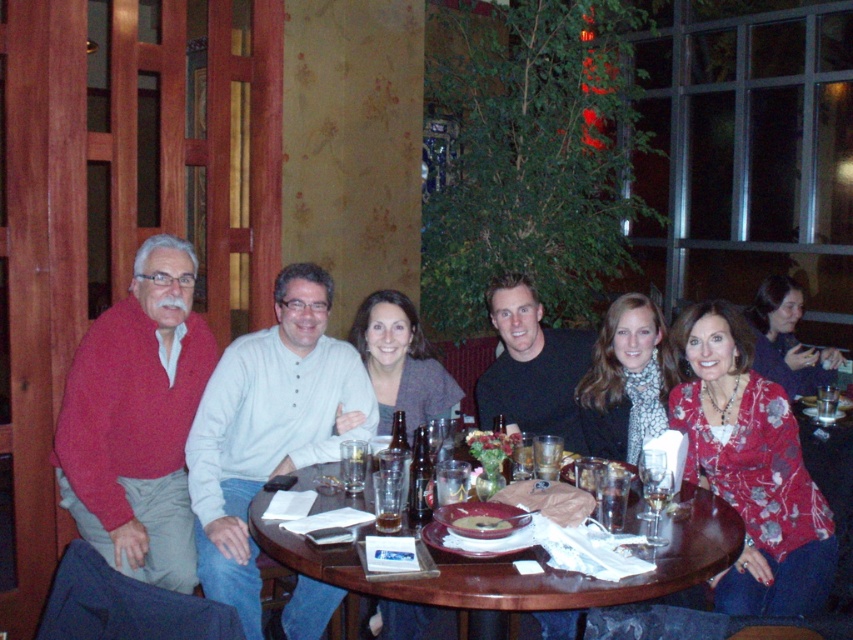
Question: Is knitted red sweater at left smaller than white button-down shirt at center?

Choices:
 (A) no
 (B) yes

Answer: (B)

Question: Where is knitted red sweater at left located in relation to dark blue sweater at right in the image?

Choices:
 (A) above
 (B) below

Answer: (B)

Question: Does matte red sweater at left have a lesser width compared to translucent glass at table center?

Choices:
 (A) no
 (B) yes

Answer: (A)

Question: Which object is farther from the camera taking this photo?

Choices:
 (A) floral-patterned blouse at lower right
 (B) matte red sweater at left

Answer: (B)

Question: Among these objects, which one is nearest to the camera?

Choices:
 (A) smooth brown bread at center
 (B) floral-patterned blouse at lower right
 (C) brown wooden table at center
 (D) dark blue sweater at right

Answer: (C)

Question: Which point is closer to the camera taking this photo?

Choices:
 (A) (209, 397)
 (B) (706, 465)
 (C) (183, 477)

Answer: (B)